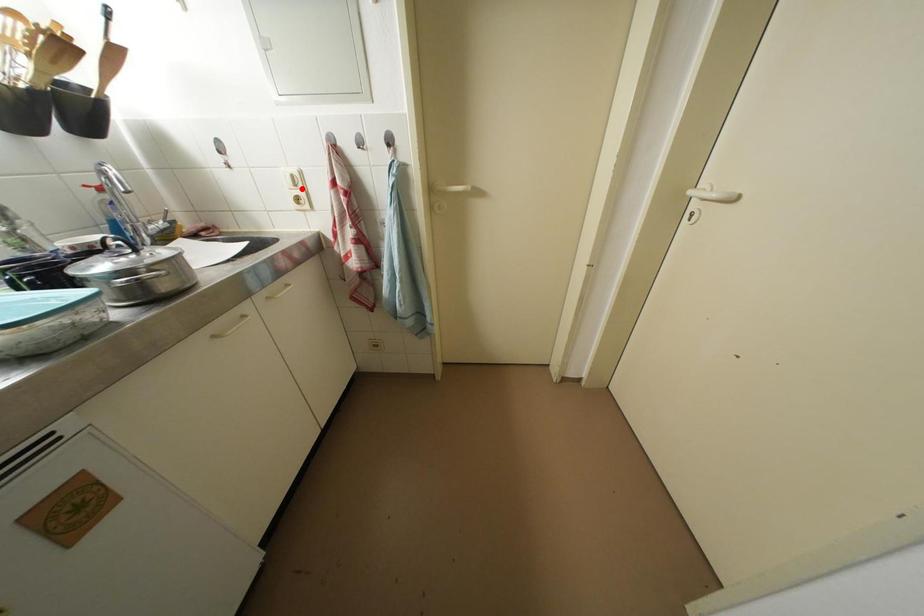
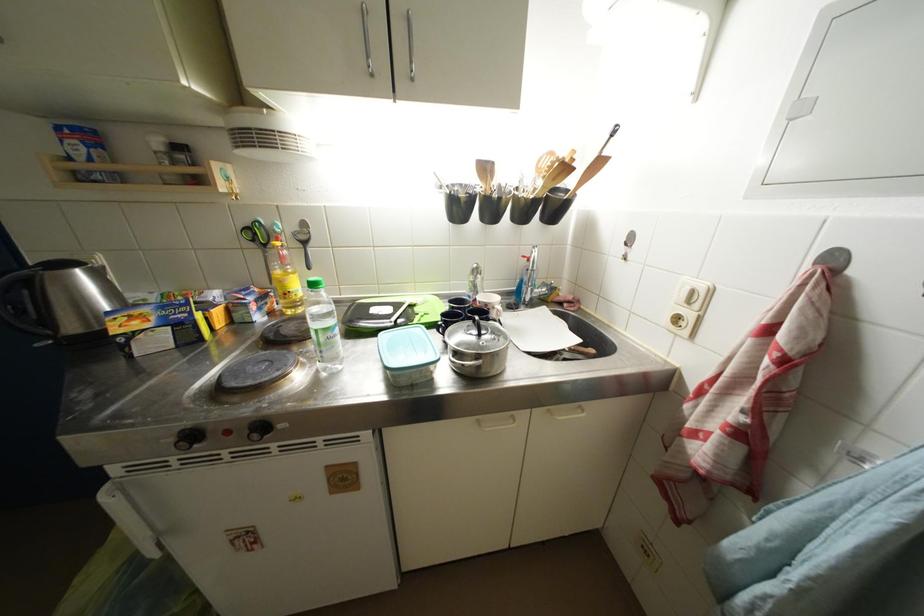
In the second image, find the point that corresponds to the highlighted location in the first image.

(696, 306)